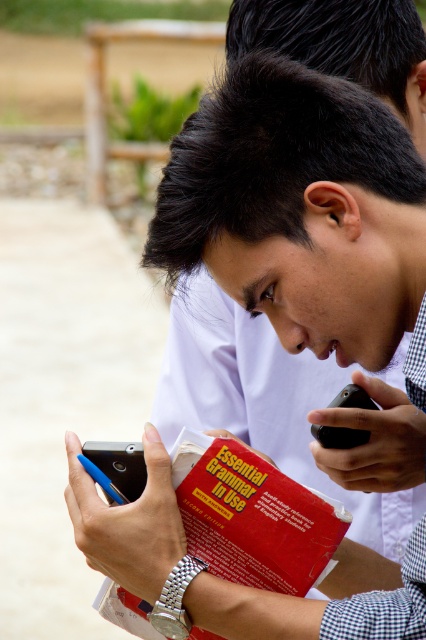
Based on the photo, does red matte book at center appear on the left side of blue glossy smartphone at lower left?

Incorrect, red matte book at center is not on the left side of blue glossy smartphone at lower left.

Between red matte book at center and blue glossy smartphone at lower left, which one has less height?

Standing shorter between the two is blue glossy smartphone at lower left.

Measure the distance between point (192,554) and camera.

4.17 feet

This screenshot has height=640, width=426. I want to click on red matte book at center, so click(253, 518).

Can you confirm if red matte book at center is positioned below black matte smartphone at center?

Correct, red matte book at center is located below black matte smartphone at center.

Measure the distance between red matte book at center and black matte smartphone at center.

The distance of red matte book at center from black matte smartphone at center is 26.36 centimeters.

Is point (331, 500) positioned before point (371, 401)?

Yes, it is in front of point (371, 401).

In order to click on red matte book at center in this screenshot , I will do `click(253, 518)`.

Can you confirm if black matte smartphone at center is positioned to the left of red paper book at center?

No, black matte smartphone at center is not to the left of red paper book at center.

Can you confirm if black matte smartphone at center is taller than red paper book at center?

Yes.

Who is more forward, (359, 396) or (271, 513)?

Point (271, 513) is more forward.

Find the location of `black matte smartphone at center`. black matte smartphone at center is located at coordinates (339, 436).